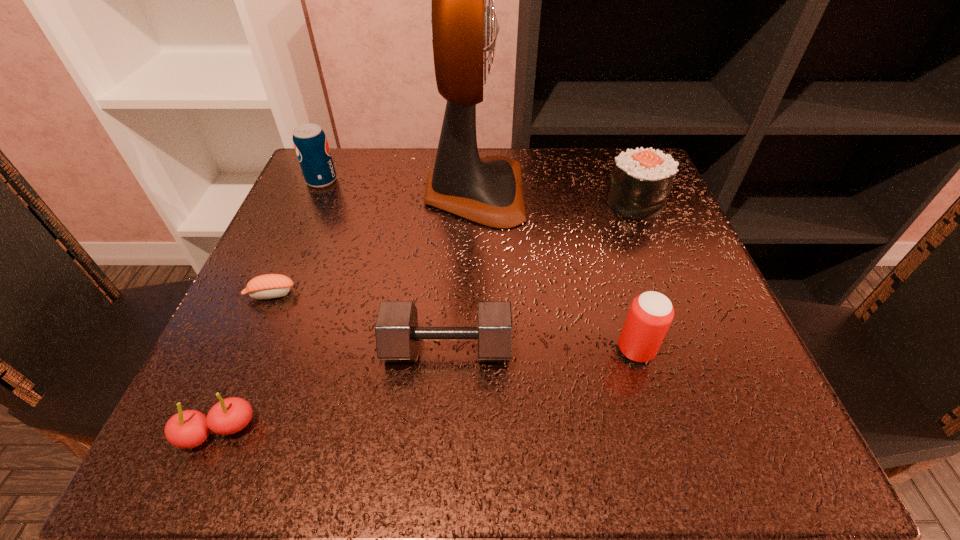
Identify the location of vacant point at the left edge. The width and height of the screenshot is (960, 540). (274, 273).

In the image, there is a desktop. What are the coordinates of `vacant area at the right edge` in the screenshot? It's located at click(x=678, y=314).

The height and width of the screenshot is (540, 960). Find the location of `vacant region at the far left corner of the desktop`. vacant region at the far left corner of the desktop is located at coordinates (317, 193).

In the image, there is a desktop. At what (x,y) coordinates should I click in order to perform the action: click on vacant space at the near right corner. Please return your answer as a coordinate pair (x, y). The height and width of the screenshot is (540, 960). Looking at the image, I should click on pyautogui.click(x=783, y=439).

Find the location of a particular element. The image size is (960, 540). free point between the tallest object and the dumbbell is located at coordinates (461, 271).

The width and height of the screenshot is (960, 540). What are the coordinates of `free space between the pop and the cherry` in the screenshot? It's located at (270, 306).

Locate an element on the screen. Image resolution: width=960 pixels, height=540 pixels. vacant area between the pop and the cherry is located at coordinates (270, 306).

Locate an element on the screen. Image resolution: width=960 pixels, height=540 pixels. empty space between the fourth farthest object and the beer can is located at coordinates (453, 322).

Locate an element on the screen. This screenshot has width=960, height=540. free space between the beer can and the left sushi is located at coordinates (453, 322).

You are a GUI agent. You are given a task and a screenshot of the screen. Output one action in this format:
    pyautogui.click(x=<x>, y=<y>)
    Task: Click on the free spot between the shortest object and the pop
    This screenshot has height=540, width=960.
    Given the screenshot: What is the action you would take?
    pyautogui.click(x=297, y=238)